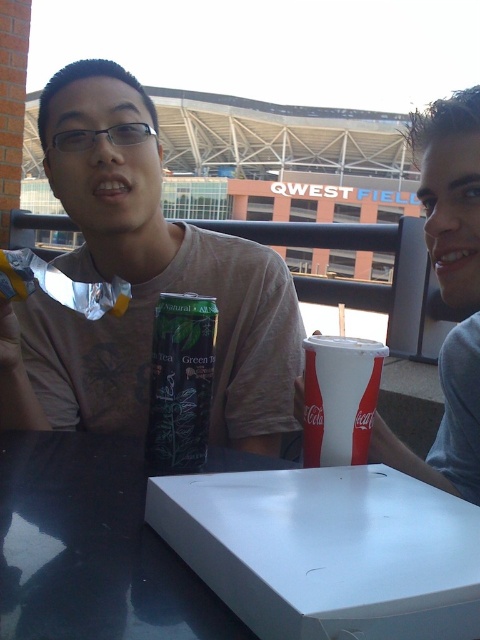
You are a delivery person who needs to place a new pizza box at point (141, 284). However, there is already an object there. What object is blocking the delivery location?

The green matte can at center is located at point (141, 284), so it is blocking the delivery location.

From the picture: You are a waiter at a cafe and need to deliver two items to customers. The first is a green matte tea bag at center and the second is a white paper cup at center. According to the scene, which item is positioned to the left of the other?

The green matte tea bag at center is positioned to the left of the white paper cup at center.